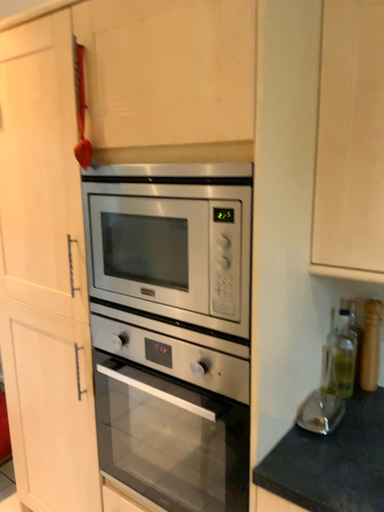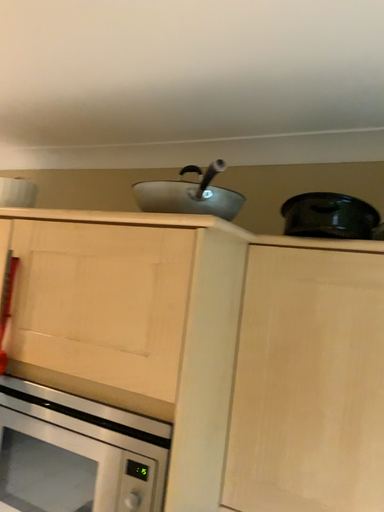
Question: Which way did the camera rotate in the video?

Choices:
 (A) rotated left
 (B) rotated right

Answer: (B)